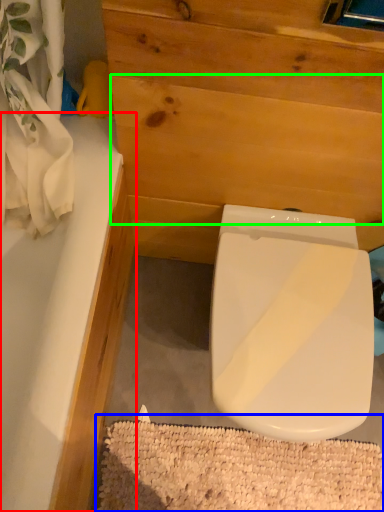
Question: Estimate the real-world distances between objects in this image. Which object is closer to bathtub (highlighted by a red box), bath mat (highlighted by a blue box) or plywood (highlighted by a green box)?

Choices:
 (A) bath mat
 (B) plywood

Answer: (B)